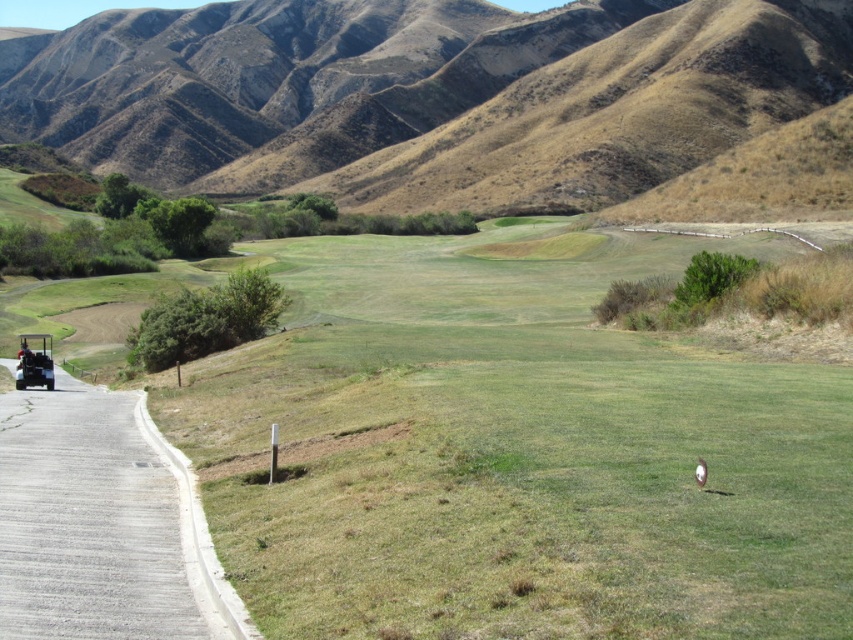
You are standing at the golf cart visible in the distance on the left side pathway. You want to walk to the center of the green grassy field. Is the point at coordinate point (x=515, y=451) on your path?

The point at coordinate point (x=515, y=451) is on the green grassy field at center, so yes, it is on your path from the golf cart on the left side pathway to the center of the green grassy field.